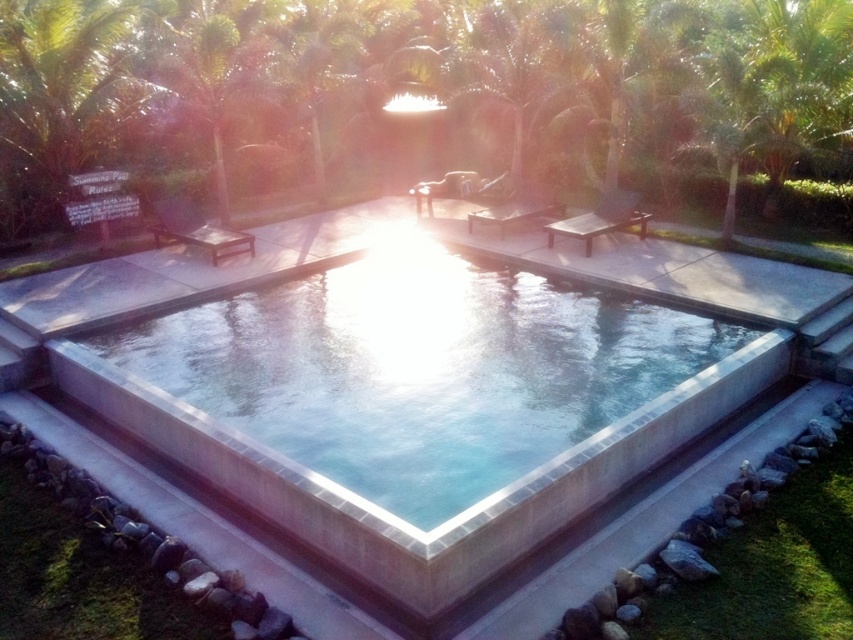
Is point (827, 115) farther from camera compared to point (415, 518)?

Yes.

Is point (724, 156) positioned in front of point (436, 362)?

No.

Where is `green leafy tree at upper center`? The image size is (853, 640). green leafy tree at upper center is located at coordinates (428, 99).

Can you confirm if green leafy tree at upper center is bigger than matte brown lounge chair at center?

Indeed, green leafy tree at upper center has a larger size compared to matte brown lounge chair at center.

Locate an element on the screen. The height and width of the screenshot is (640, 853). green leafy tree at upper center is located at coordinates (428, 99).

What do you see at coordinates (428, 99) in the screenshot? This screenshot has height=640, width=853. I see `green leafy tree at upper center` at bounding box center [428, 99].

Locate an element on the screen. green leafy tree at upper center is located at coordinates (428, 99).

From the picture: Does smooth concrete pool at center have a greater width compared to matte brown lounge chair at center?

No.

Between smooth concrete pool at center and matte brown lounge chair at center, which one has more height?

matte brown lounge chair at center is taller.

Describe the element at coordinates (421, 371) in the screenshot. The image size is (853, 640). I see `smooth concrete pool at center` at that location.

The height and width of the screenshot is (640, 853). Find the location of `smooth concrete pool at center`. smooth concrete pool at center is located at coordinates (421, 371).